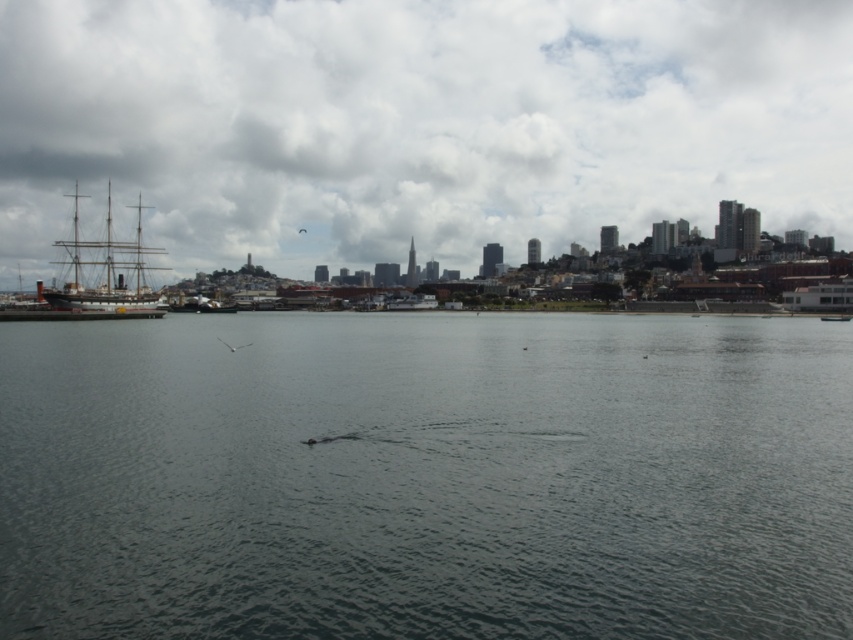
Is cloudy sky at upper center to the right of wooden ship at left from the viewer's perspective?

Yes, cloudy sky at upper center is to the right of wooden ship at left.

Which is behind, point (746, 188) or point (97, 246)?

Point (746, 188)

Does point (375, 211) come closer to viewer compared to point (49, 291)?

No, (375, 211) is further to viewer.

In order to click on cloudy sky at upper center in this screenshot , I will do `click(416, 124)`.

Can you confirm if dark gray water at center is smaller than cloudy sky at upper center?

Correct, dark gray water at center occupies less space than cloudy sky at upper center.

This screenshot has height=640, width=853. I want to click on dark gray water at center, so click(426, 476).

Does point (408, 468) lie in front of point (88, 298)?

Yes, point (408, 468) is in front of point (88, 298).

Looking at this image, who is more distant from viewer, (115, 557) or (94, 246)?

Positioned behind is point (94, 246).

The height and width of the screenshot is (640, 853). In order to click on dark gray water at center in this screenshot , I will do `click(426, 476)`.